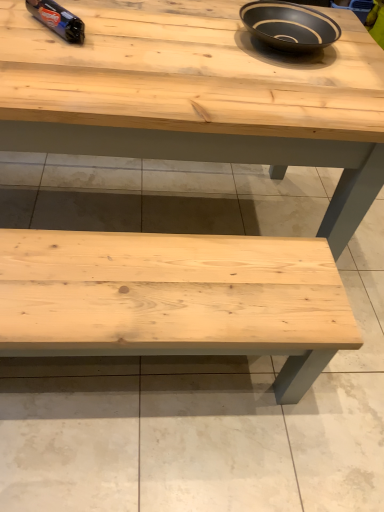
This screenshot has width=384, height=512. I want to click on free spot in front of black matte bowl at upper center, so click(286, 82).